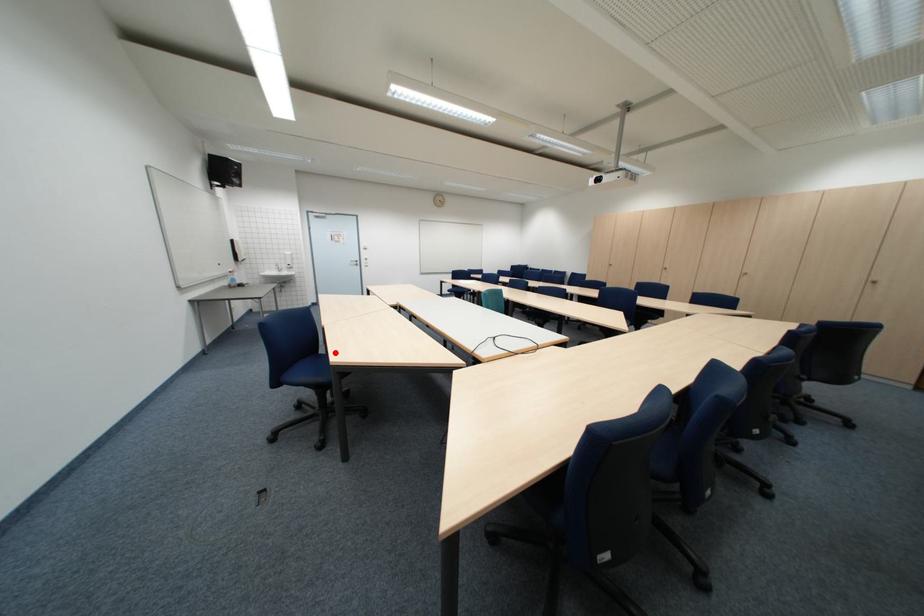
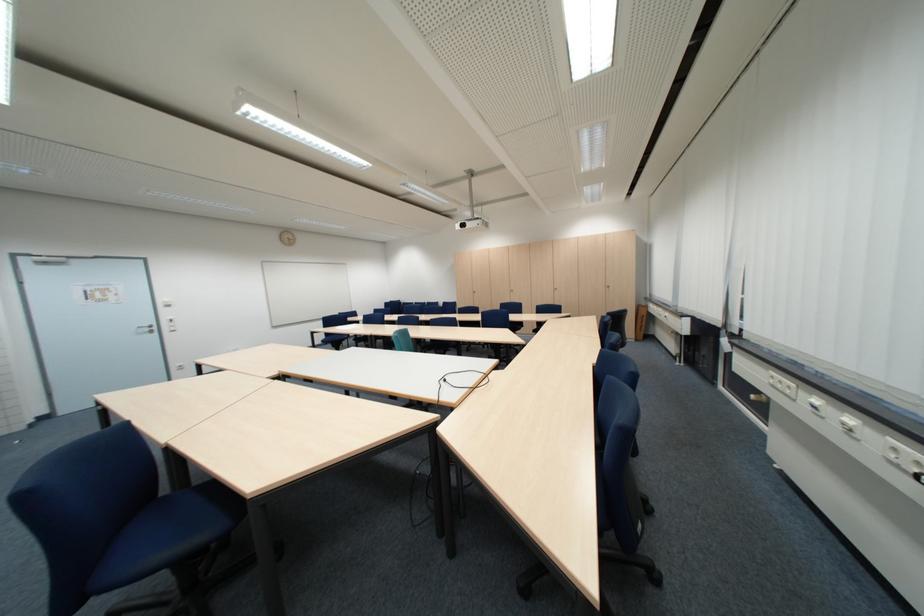
The point at the highlighted location is marked in the first image. Where is the corresponding point in the second image?

(177, 492)